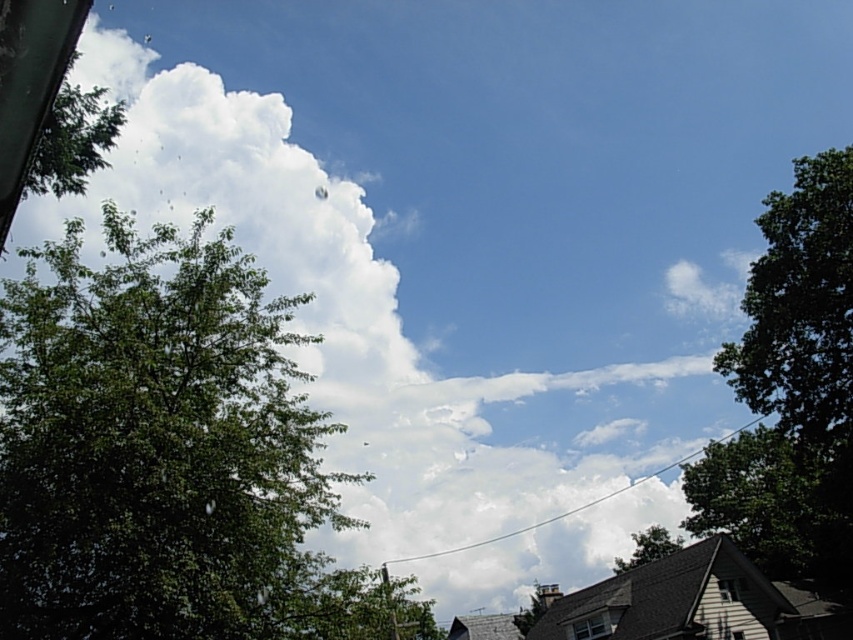
You are standing in the center of the image. Which direction should you walk to reach the green leafy tree at left?

The green leafy tree at left is located at point 0.700 on the x and y 0.185, so you should walk to the left to reach it.

You are standing in the middle of the scene and want to walk towards the nearest green leafy tree. Which tree should you head towards, the green leafy tree at left or the green leafy tree at center?

The green leafy tree at center is closer to you since you are standing in the middle of the scene, so you should head towards the green leafy tree at center.